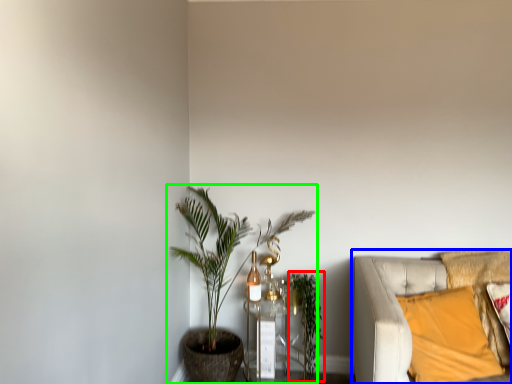
Question: Which object is the farthest from vegetation (highlighted by a red box)? Choose among these: studio couch (highlighted by a blue box) or houseplant (highlighted by a green box).

Choices:
 (A) studio couch
 (B) houseplant

Answer: (A)